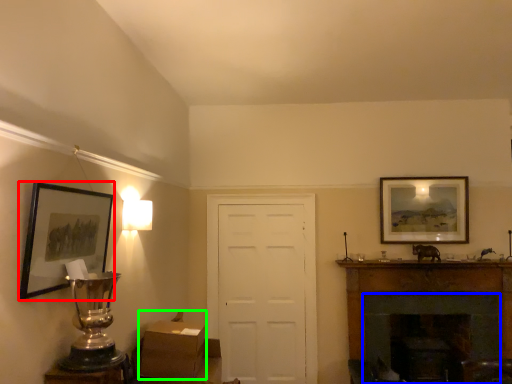
Question: Which object is the closest to the picture frame (highlighted by a red box)? Choose among these: fireplace (highlighted by a blue box) or cardboard box (highlighted by a green box).

Choices:
 (A) fireplace
 (B) cardboard box

Answer: (B)